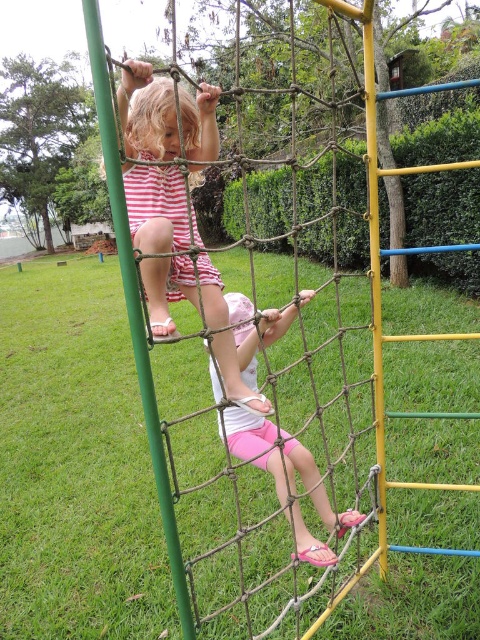
You are a photographer trying to capture the striped cotton dress at upper left in the center of your camera frame. Given the dress is at coordinate point 0.325, 0.325, would you need to adjust your camera position to center it? Please explain using the coordinate system where the bottom left corner is 0,0 and the top right is 1,1.

The striped cotton dress at upper left is located at coordinate point (156,208). To center it in the frame, the camera should be adjusted to move towards the upper left direction since the current position is closer to the bottom right corner of the coordinate system. The center of the frame would be at (240,320), so moving the camera towards the upper left would align the dress at (156,208) closer to the center.

You are a parent watching your children play at the playground. You see the striped cotton dress at upper left and the pink fabric shorts at lower center. Which child is higher up on the climbing structure?

The striped cotton dress at upper left is located above the pink fabric shorts at lower center, so the child wearing the striped cotton dress at upper left is higher up on the climbing structure.

You are a parent supervising children at the playground. You notice two children wearing striped cotton dress at upper left and pink fabric shorts at lower center. Which child is positioned more to the left side of the climbing structure?

The striped cotton dress at upper left is positioned to the left of pink fabric shorts at lower center, so the child wearing the striped cotton dress at upper left is more to the left side of the climbing structure.